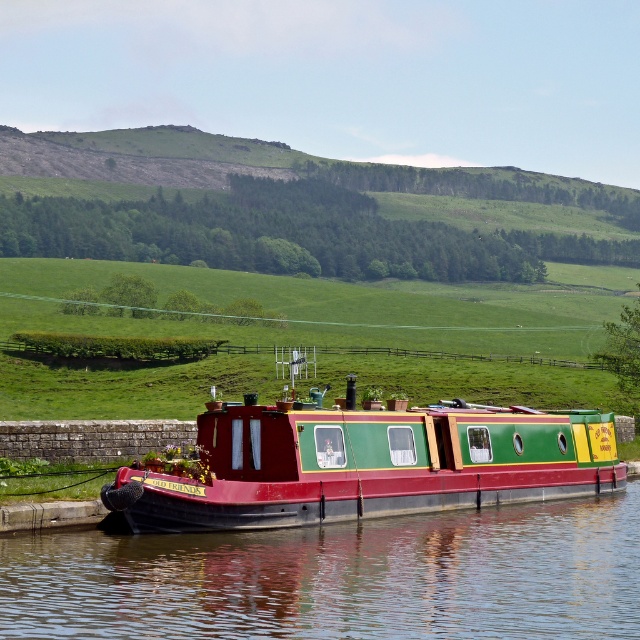
You are standing on a bridge overlooking the canal and see the smooth dark water at center and the matte green and red boat at center. Which object is closer to you?

The smooth dark water at center is closer to the viewer than the matte green and red boat at center.

You are standing on the dock and looking at the smooth dark water at center and the matte green and red boat at center. Which object is taller from your perspective?

The matte green and red boat at center is taller than the smooth dark water at center.